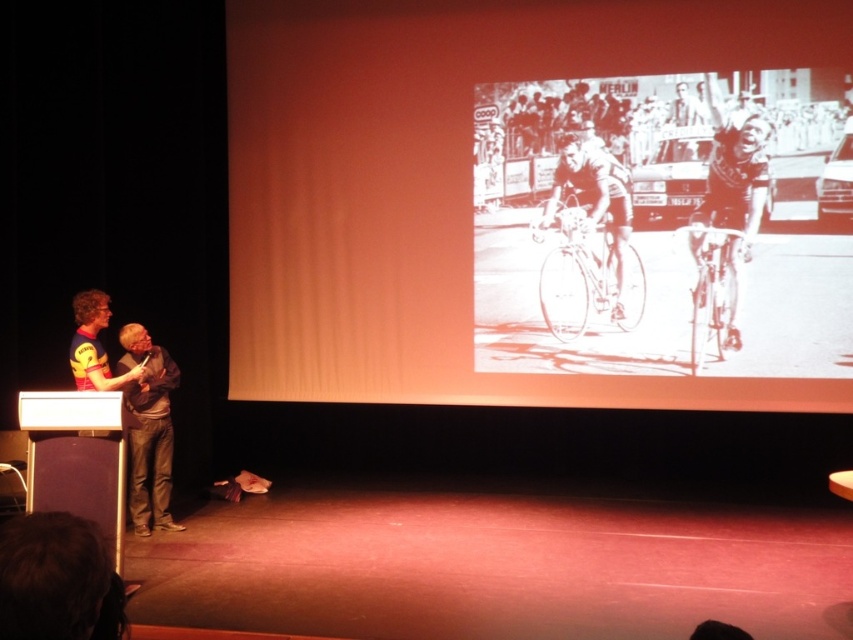
Question: Is matte black shirt at left to the right of yellow jersey at left from the viewer's perspective?

Choices:
 (A) no
 (B) yes

Answer: (B)

Question: Which point is farther from the camera taking this photo?

Choices:
 (A) (329, 248)
 (B) (614, 276)
 (C) (160, 404)

Answer: (A)

Question: Which point is farther to the camera?

Choices:
 (A) (131, 384)
 (B) (604, 164)
 (C) (703, 211)

Answer: (B)

Question: Is black and white drawing of cyclists at center closer to the viewer compared to white fabric cyclist at center?

Choices:
 (A) yes
 (B) no

Answer: (A)

Question: Can you confirm if smooth skin cyclist at center is positioned to the right of white fabric cyclist at center?

Choices:
 (A) yes
 (B) no

Answer: (A)

Question: Estimate the real-world distances between objects in this image. Which object is farther from the smooth skin cyclist at center?

Choices:
 (A) yellow jersey at left
 (B) white fabric cyclist at center
 (C) matte black shirt at left

Answer: (A)